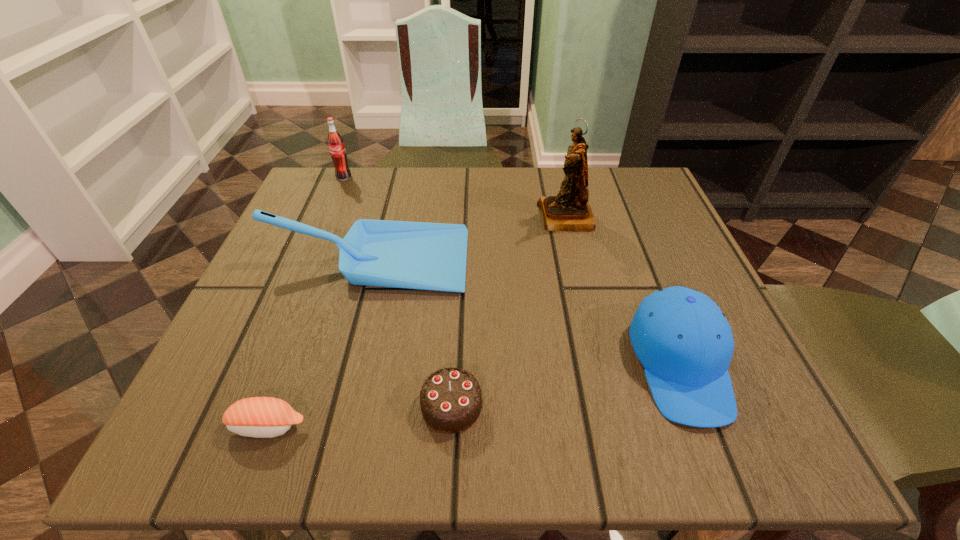
Find the location of `vacant space located 0.290m on the label of the soda bottle`. vacant space located 0.290m on the label of the soda bottle is located at coordinates (309, 261).

The width and height of the screenshot is (960, 540). What are the coordinates of `free space located on the front of the dustpan` in the screenshot? It's located at (340, 365).

This screenshot has width=960, height=540. I want to click on vacant space positioned on the back of the chocolate cake, so click(455, 343).

What are the coordinates of `free space located 0.350m on the right of the shortest object` in the screenshot? It's located at click(x=558, y=426).

Locate an element on the screen. This screenshot has height=540, width=960. figurine that is at the far edge is located at coordinates (568, 211).

Identify the location of soda bottle that is positioned at the far edge. pyautogui.click(x=336, y=145).

Identify the location of cap that is at the near edge. (684, 342).

Locate an element on the screen. chocolate cake positioned at the near edge is located at coordinates (450, 399).

You are a GUI agent. You are given a task and a screenshot of the screen. Output one action in this format:
    pyautogui.click(x=<x>, y=<y>)
    Task: Click on the sushi located in the near edge section of the desktop
    
    Given the screenshot: What is the action you would take?
    pyautogui.click(x=262, y=417)

I want to click on soda bottle at the left edge, so click(x=336, y=145).